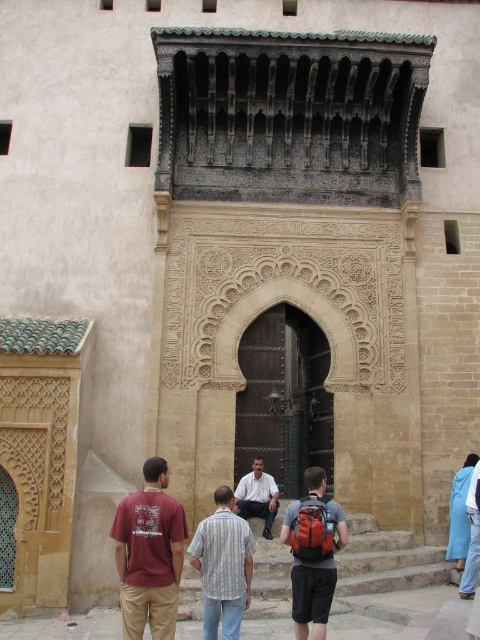
Question: Which object is positioned closest to the striped cotton shirt at center?

Choices:
 (A) dark wood door at center
 (B) orange fabric backpack at center
 (C) light brown leather pants at center
 (D) blue fabric at lower right

Answer: (B)

Question: Is light brown leather pants at center thinner than blue fabric at lower right?

Choices:
 (A) yes
 (B) no

Answer: (B)

Question: Which of the following is the farthest from the observer?

Choices:
 (A) (275, 426)
 (B) (303, 604)
 (C) (212, 573)
 (D) (158, 609)

Answer: (A)

Question: Is maroon t-shirt at center to the right of orange fabric backpack at center from the viewer's perspective?

Choices:
 (A) no
 (B) yes

Answer: (A)

Question: Which of the following is the farthest from the observer?

Choices:
 (A) striped cotton shirt at center
 (B) blue fabric at lower right

Answer: (B)

Question: Considering the relative positions of maroon t-shirt at center and light brown leather pants at center in the image provided, where is maroon t-shirt at center located with respect to light brown leather pants at center?

Choices:
 (A) below
 (B) above

Answer: (B)